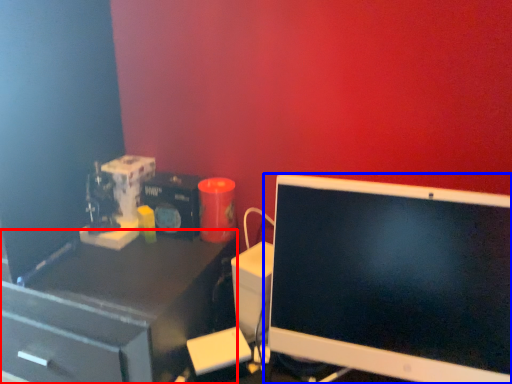
Question: Which object is closer to the camera taking this photo, desk (highlighted by a red box) or computer monitor (highlighted by a blue box)?

Choices:
 (A) desk
 (B) computer monitor

Answer: (B)